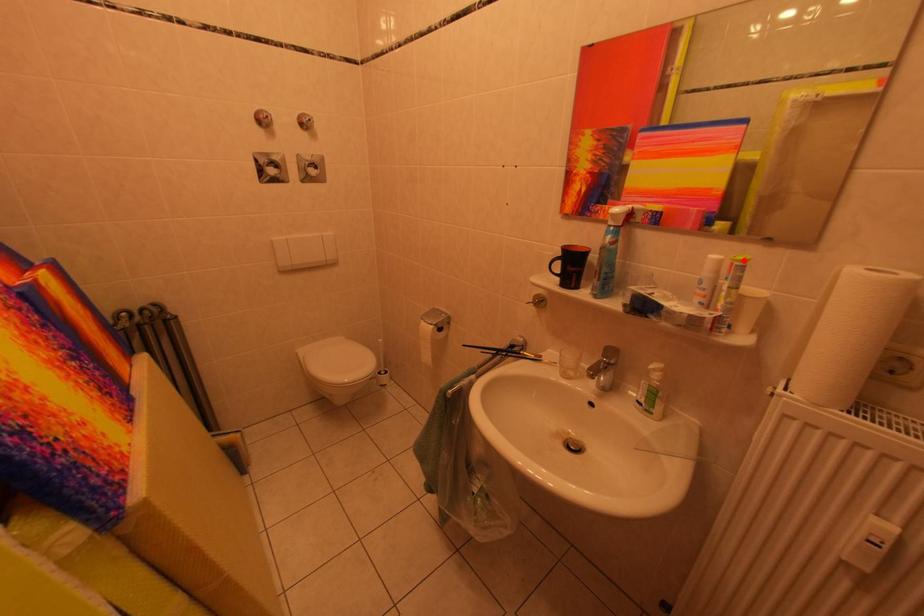
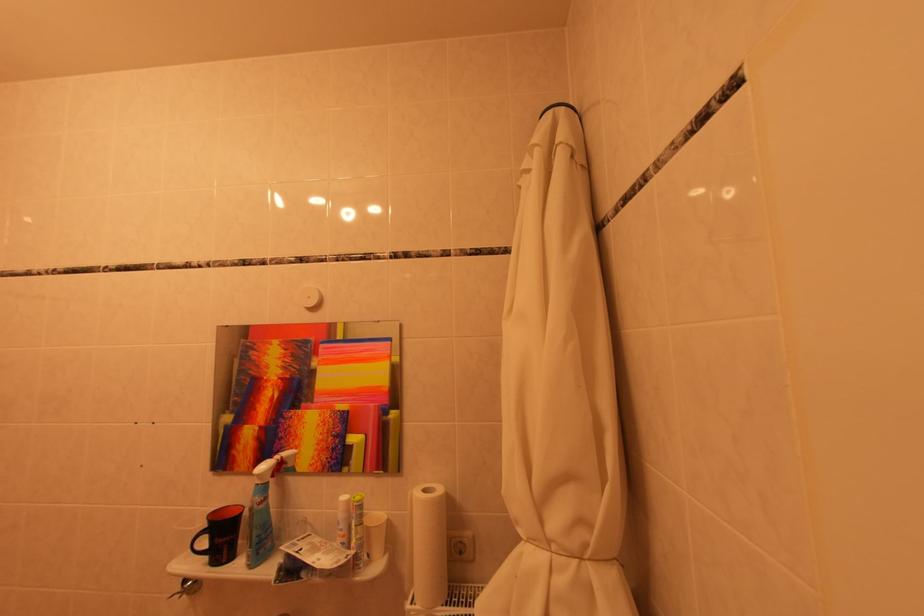
In the second image, find the point that corresponds to the highlighted location in the first image.

(362, 501)